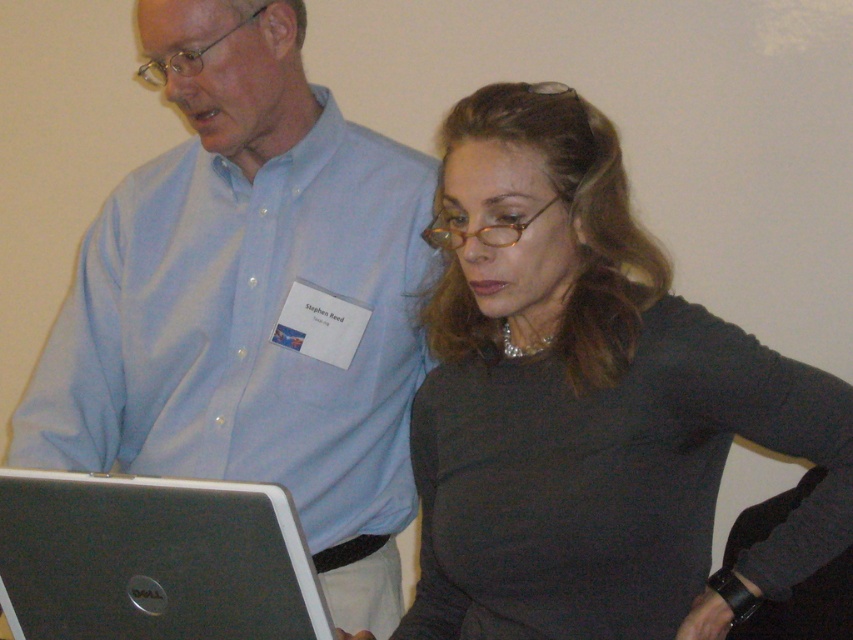
Question: Can you confirm if matte blue shirt at center is bigger than silver metallic laptop at lower left?

Choices:
 (A) no
 (B) yes

Answer: (B)

Question: Does matte blue shirt at center have a smaller size compared to silver metallic laptop at lower left?

Choices:
 (A) yes
 (B) no

Answer: (B)

Question: Which of the following is the closest to the observer?

Choices:
 (A) (67, 593)
 (B) (402, 333)

Answer: (A)

Question: Which point is closer to the camera?

Choices:
 (A) (392, 381)
 (B) (527, 524)
 (C) (160, 483)

Answer: (C)

Question: Among these objects, which one is nearest to the camera?

Choices:
 (A) silver metallic laptop at lower left
 (B) matte gray sweater at center
 (C) matte blue shirt at center

Answer: (A)

Question: Does matte gray sweater at center have a greater width compared to silver metallic laptop at lower left?

Choices:
 (A) yes
 (B) no

Answer: (A)